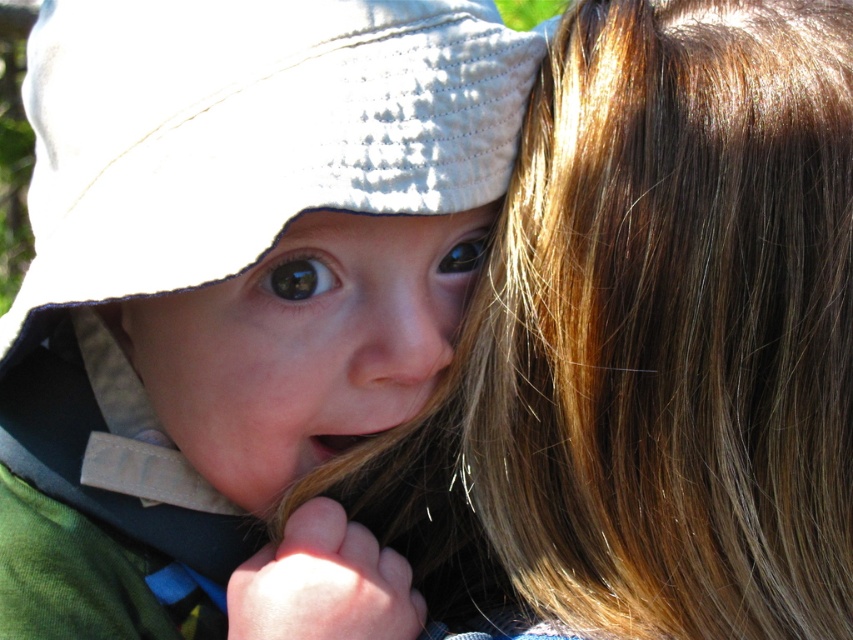
Can you confirm if matte white hat at upper left is taller than glossy blue eye at center?

Correct, matte white hat at upper left is much taller as glossy blue eye at center.

Who is shorter, matte white hat at upper left or glossy blue eye at center?

Standing shorter between the two is glossy blue eye at center.

Find the location of `matte white hat at upper left`. matte white hat at upper left is located at coordinates (235, 300).

Identify the location of matte white hat at upper left. (235, 300).

Does smooth skin face at center appear under glossy blue eye at center?

Indeed, smooth skin face at center is positioned under glossy blue eye at center.

This screenshot has width=853, height=640. Describe the element at coordinates (300, 346) in the screenshot. I see `smooth skin face at center` at that location.

Does point (334, 369) lie behind point (477, 243)?

No, it is not.

In order to click on smooth skin face at center in this screenshot , I will do `click(300, 346)`.

The width and height of the screenshot is (853, 640). In order to click on smooth skin face at center in this screenshot , I will do `click(300, 346)`.

Can you confirm if smooth skin face at center is shorter than black glossy eye at center?

No.

The image size is (853, 640). Find the location of `smooth skin face at center`. smooth skin face at center is located at coordinates (300, 346).